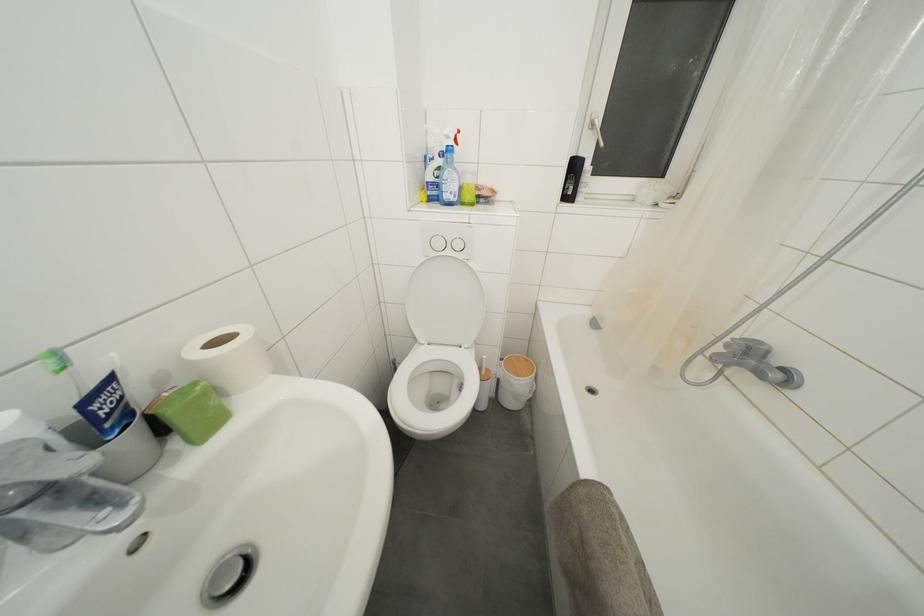
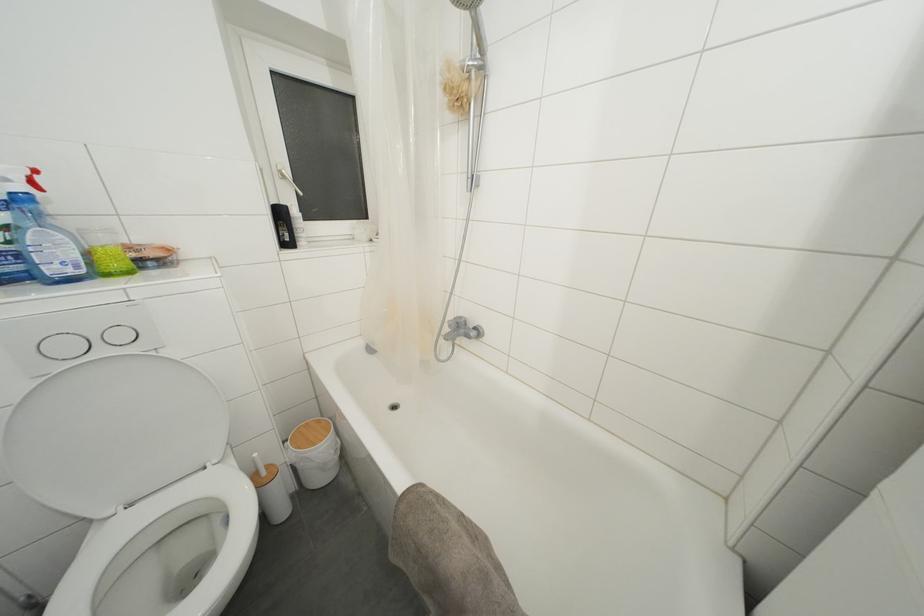
Question: The first image is from the beginning of the video and the second image is from the end. How did the camera likely rotate when shooting the video?

Choices:
 (A) Left
 (B) Right
 (C) Up
 (D) Down

Answer: (B)